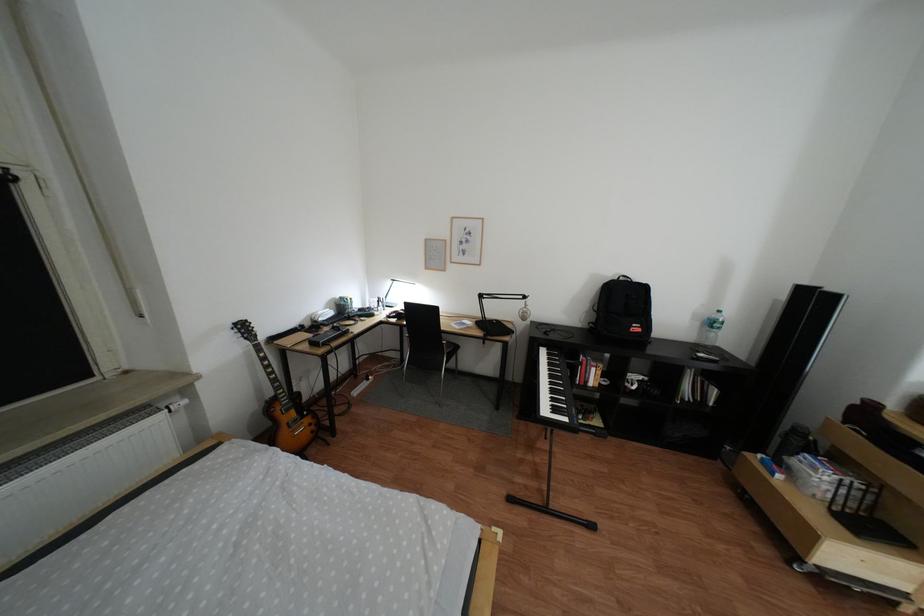
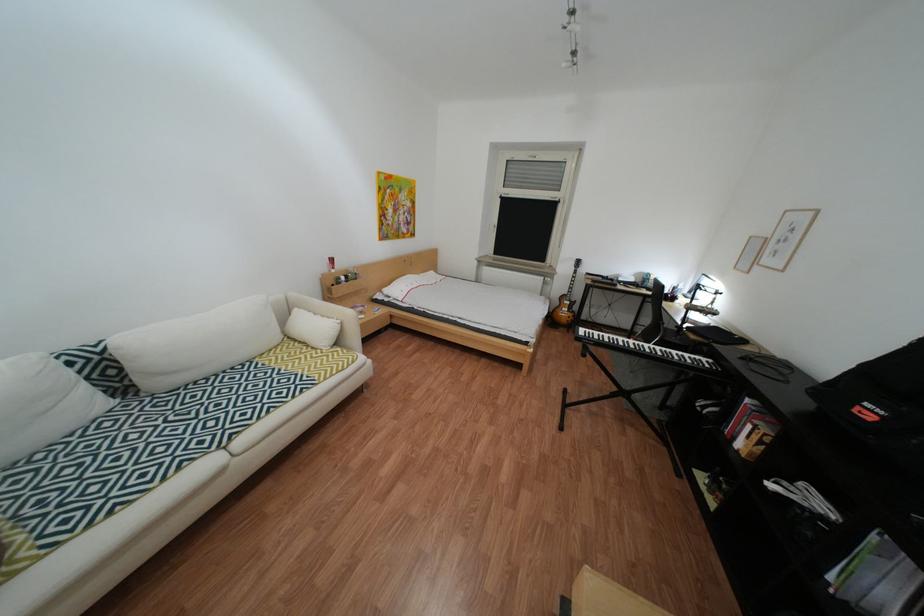
Locate, in the second image, the point that corresponds to point (602, 383) in the first image.

(749, 439)